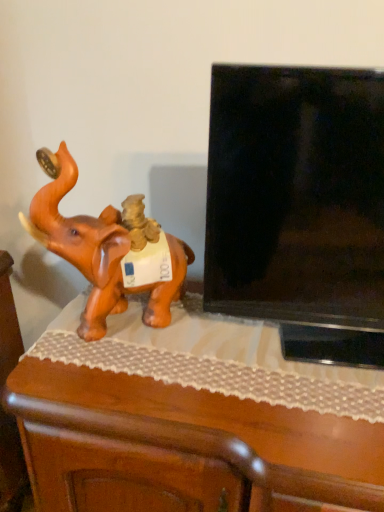
Question: Is orange matte elephant at left facing towards black glossy tv at right?

Choices:
 (A) yes
 (B) no

Answer: (B)

Question: Is orange matte elephant at left turned away from black glossy tv at right?

Choices:
 (A) yes
 (B) no

Answer: (B)

Question: Is the surface of orange matte elephant at left in direct contact with black glossy tv at right?

Choices:
 (A) yes
 (B) no

Answer: (B)

Question: Can you confirm if orange matte elephant at left is positioned to the right of black glossy tv at right?

Choices:
 (A) no
 (B) yes

Answer: (A)

Question: Is the depth of orange matte elephant at left greater than that of black glossy tv at right?

Choices:
 (A) no
 (B) yes

Answer: (B)

Question: Would you say black glossy tv at right is inside or outside wooden table at left?

Choices:
 (A) inside
 (B) outside

Answer: (B)

Question: Is point (329, 339) closer or farther from the camera than point (175, 436)?

Choices:
 (A) farther
 (B) closer

Answer: (A)

Question: From a real-world perspective, is black glossy tv at right positioned above or below wooden table at left?

Choices:
 (A) below
 (B) above

Answer: (B)

Question: From the image's perspective, is black glossy tv at right located above or below wooden table at left?

Choices:
 (A) below
 (B) above

Answer: (B)

Question: In terms of width, does orange matte elephant at left look wider or thinner when compared to wooden table at left?

Choices:
 (A) wide
 (B) thin

Answer: (B)

Question: From the image's perspective, relative to wooden table at left, is orange matte elephant at left above or below?

Choices:
 (A) above
 (B) below

Answer: (A)

Question: Is point (49, 236) positioned closer to the camera than point (205, 402)?

Choices:
 (A) closer
 (B) farther

Answer: (B)

Question: Based on their sizes in the image, would you say orange matte elephant at left is bigger or smaller than wooden table at left?

Choices:
 (A) small
 (B) big

Answer: (A)

Question: Relative to orange matte elephant at left, is black glossy tv at right in front or behind?

Choices:
 (A) front
 (B) behind

Answer: (A)

Question: Is black glossy tv at right to the left or to the right of orange matte elephant at left in the image?

Choices:
 (A) left
 (B) right

Answer: (B)